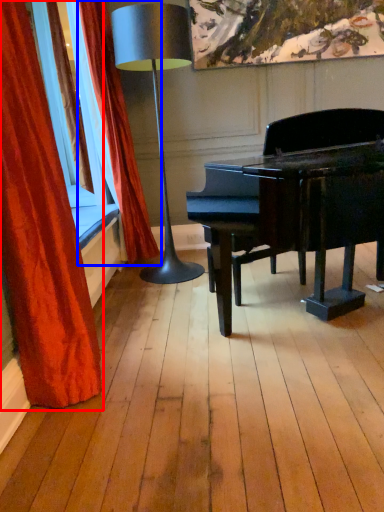
Question: Which object appears farthest to the camera in this image, curtain (highlighted by a red box) or curtain (highlighted by a blue box)?

Choices:
 (A) curtain
 (B) curtain

Answer: (B)